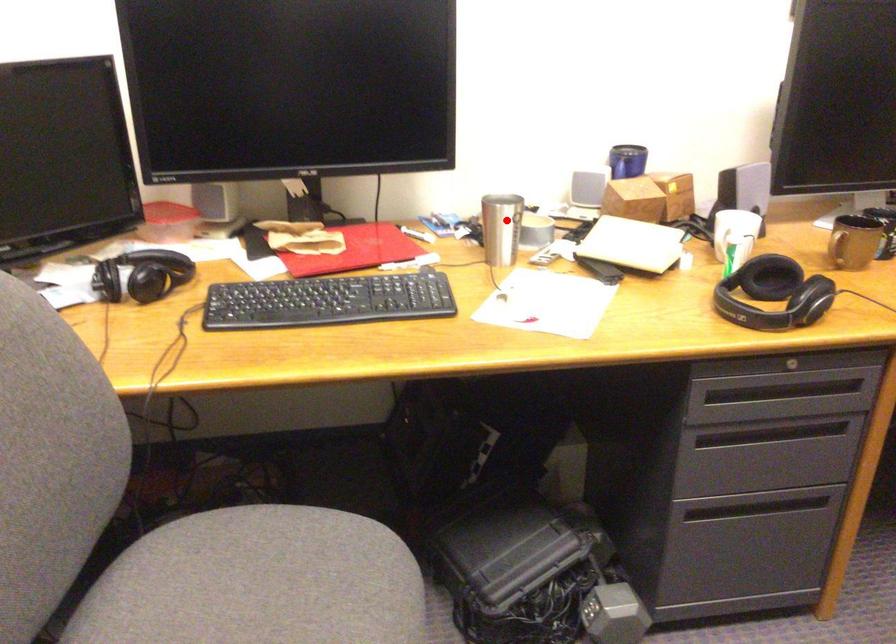
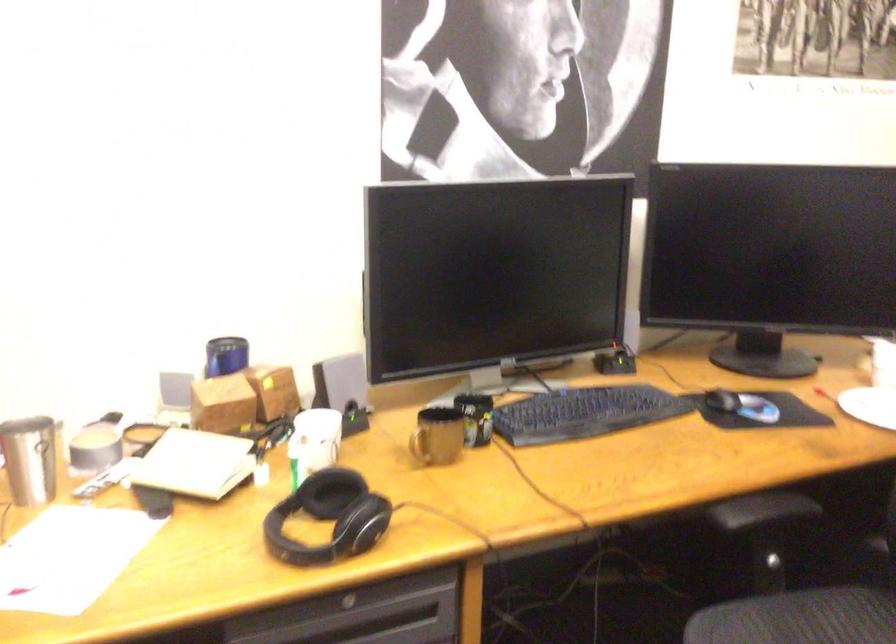
Question: I am providing you with two images of the same scene from different viewpoints. Given a red point in image1, look at the same physical point in image2. Is it:

Choices:
 (A) Closer to the viewpoint
 (B) Farther from the viewpoint

Answer: (A)